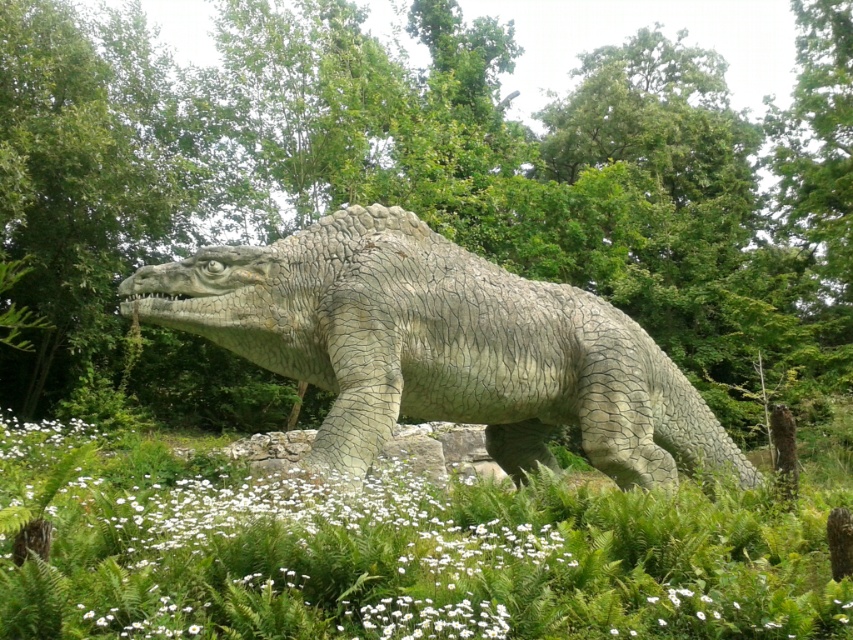
You are a gardener who wants to place a new plant between the gray textured dinosaur at center and the white matte flower at center. Considering their sizes, which object should you position closer to the flower to maintain balance?

The gray textured dinosaur at center is larger than the white matte flower at center, so to maintain balance, the new plant should be placed closer to the gray textured dinosaur at center.

You are standing in front of the dinosaur statue and notice a specific point marked at coordinates (416, 192). Based on the scene description, where is this point located relative to the dinosaur statue?

The point at coordinates (416, 192) is located on green leafy plants at center, which are part of the lush green environment surrounding the dinosaur statue.

Based on the photo, you are standing in front of the dinosaur statue and want to place a small decoration between the green leafy plants at center and the white matte flower at center. Which direction should you move to place it between them?

To place the decoration between the green leafy plants at center and the white matte flower at center, move towards the right side of the white matte flower at center since the green leafy plants at center are located to its right.